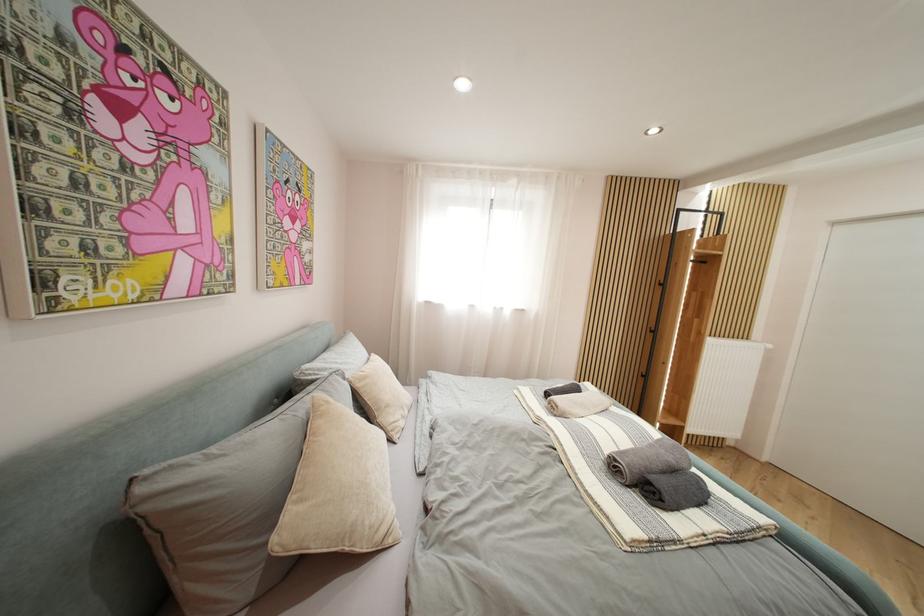
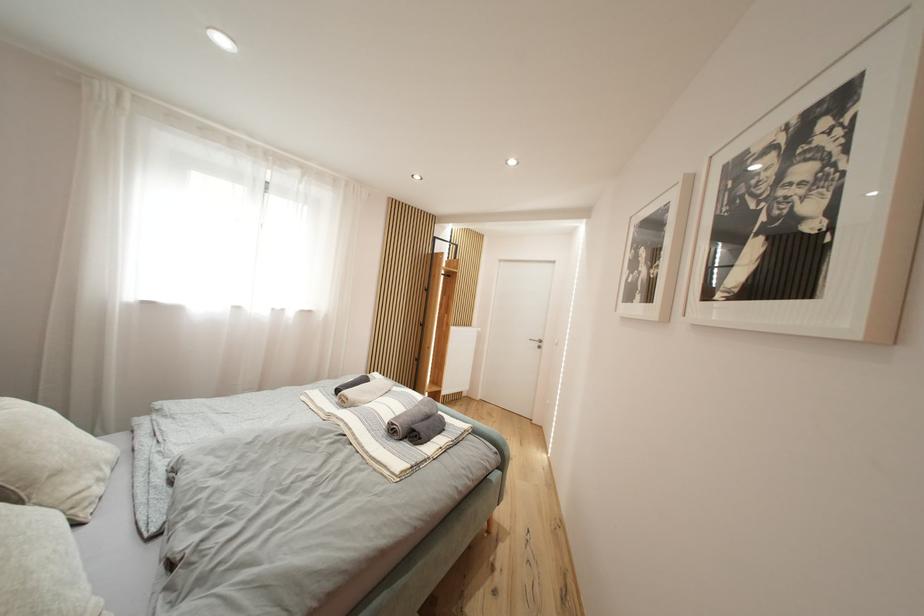
Question: How did the camera likely rotate?

Choices:
 (A) Left
 (B) Right
 (C) Up
 (D) Down

Answer: (B)